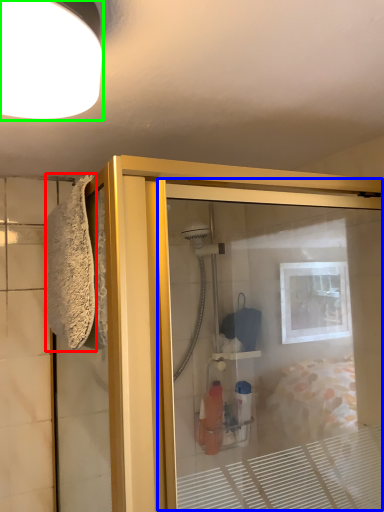
Question: Estimate the real-world distances between objects in this image. Which object is farther from bath towel (highlighted by a red box), screen door (highlighted by a blue box) or light fixture (highlighted by a green box)?

Choices:
 (A) screen door
 (B) light fixture

Answer: (A)